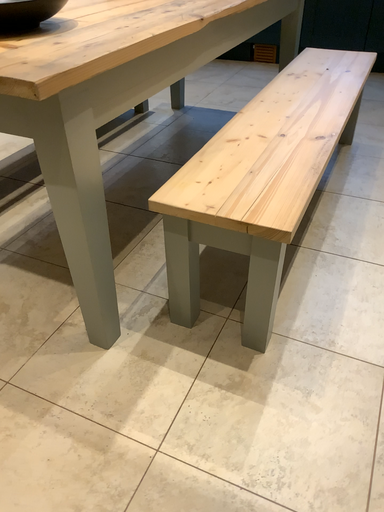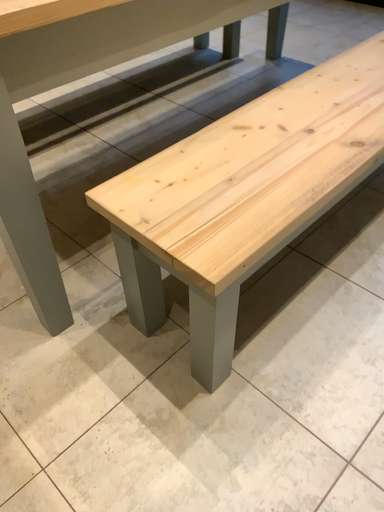
Question: How did the camera likely rotate when shooting the video?

Choices:
 (A) rotated right
 (B) rotated left

Answer: (B)